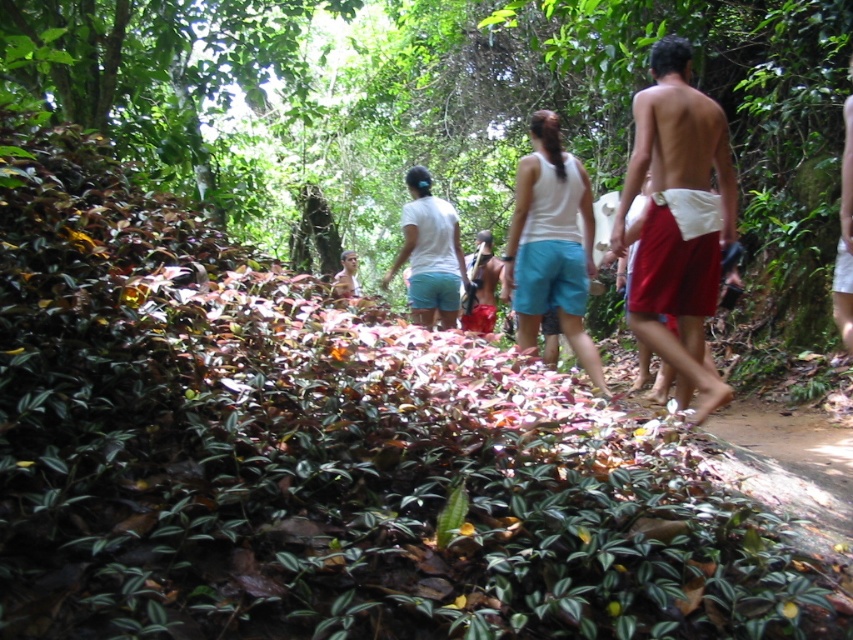
You are navigating a dense forest path and need to locate the red fabric shorts at right. According to the coordinates provided, where exactly are they positioned on the image?

The red fabric shorts at right are located at point coordinates 0.344 on the x axis and 0.796 on the y axis.

You are standing at the starting point of the forest path and want to reach the end of the path. You notice two points marked on the path. The first point is at coordinate point(717,195) and the second point is at coordinate point(526,296). Which point should you reach first while walking along the path?

Point(717,195) is closer to the camera than point(526,296), so you should reach point(717,195) first while walking along the path.

You are a hiker carrying a backpack and need to catch up with the person wearing the white cotton shirt at center. The person in red fabric shorts at right is blocking your path. Can you pass them safely if you move quickly?

The distance between the red fabric shorts at right and the white cotton shirt at center is 3.46 meters. Since the red fabric shorts at right are blocking your path, you can move around them as long as you maintain a safe distance of at least 3.46 meters to reach the white cotton shirt at center.